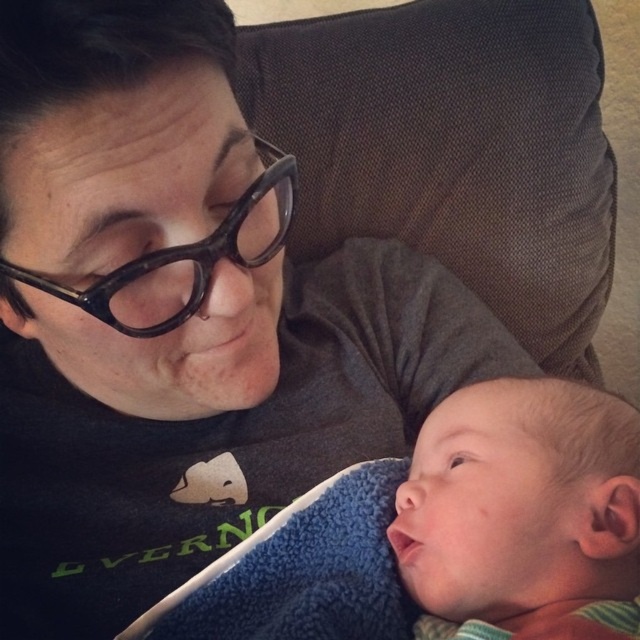
You are a photographer trying to capture the baby in the center. The blue fleece blanket at lower right is in the way. Which direction should you move the blanket to get a clear view of the smooth skin baby at center?

Since the smooth skin baby at center is to the right of the blue fleece blanket at lower right, you should move the blue fleece blanket at lower right to the left to get a clear view of the smooth skin baby at center.

Based on the scene description, where exactly is the smooth skin baby at center located in terms of coordinates?

The smooth skin baby at center is located at coordinates point (520, 500).

You are a photographer adjusting your camera to focus on the point at coordinates (580, 388). The camera has a focus range of 18 to 22 inches. Will the point be in focus?

The point at coordinates (580, 388) is 20.39 inches from the camera, which falls within the focus range of 18 to 22 inches. Therefore, the point will be in focus.